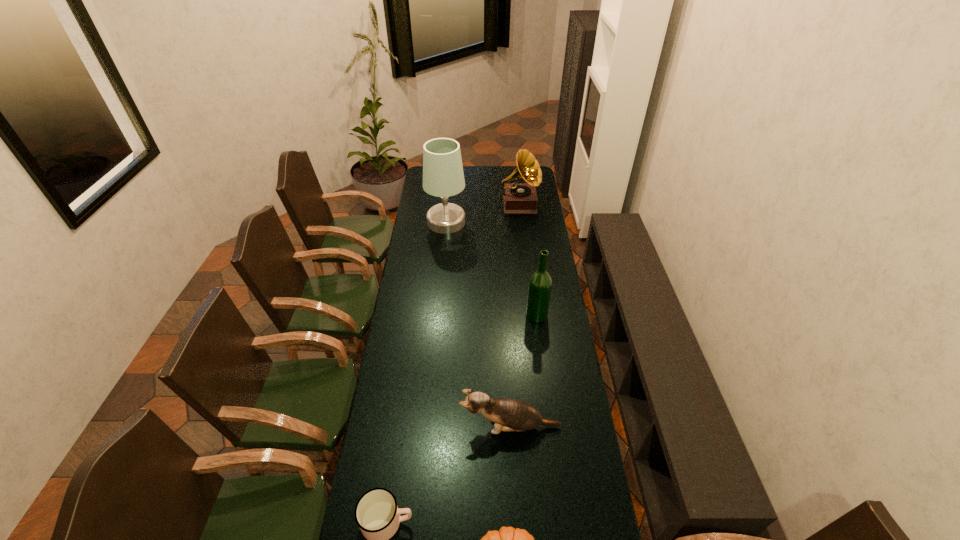
Where is `vacant point located between the tallest object and the cat`? vacant point located between the tallest object and the cat is located at coordinates (478, 324).

Locate an element on the screen. This screenshot has height=540, width=960. the fifth closest object relative to the pumpkin is located at coordinates [x=518, y=198].

I want to click on object that is the fourth closest to the pumpkin, so click(443, 176).

Identify the location of vacant area in the image that satisfies the following two spatial constraints: 1. on the back side of the fourth nearest object; 2. on the base of the tallest object. (525, 222).

The height and width of the screenshot is (540, 960). I want to click on vacant region that satisfies the following two spatial constraints: 1. from the horn of the alcohol; 2. on the right side of the phonograph record, so click(x=531, y=315).

At what (x,y) coordinates should I click in order to perform the action: click on free spot that satisfies the following two spatial constraints: 1. from the horn of the phonograph record; 2. at the face of the cat. Please return your answer as a coordinate pair (x, y). The height and width of the screenshot is (540, 960). Looking at the image, I should click on (543, 427).